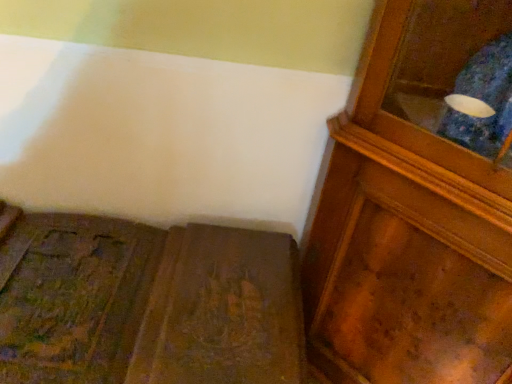
Where is `vacant point above wooden carved bench at lower left (from a real-world perspective)`? This screenshot has width=512, height=384. vacant point above wooden carved bench at lower left (from a real-world perspective) is located at coordinates (168, 304).